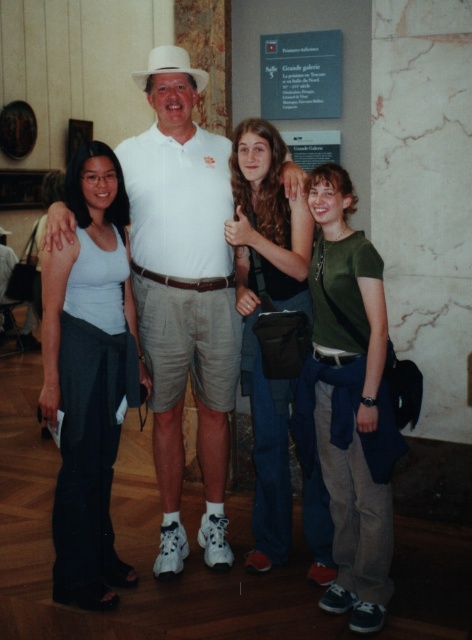
You are an artist trying to sketch the scene. You notice the green cotton shirt at center and the white matte cowboy hat at center. Which object should you draw first if you want to follow the rule of drawing taller objects before shorter ones?

The green cotton shirt at center is taller than the white matte cowboy hat at center, so you should draw the green cotton shirt at center first.

Based on the scene description, which object is taller between the white cotton shirt at center and the green matte shirt at right?

The white cotton shirt at center is much taller than the green matte shirt at right.

You are a photographer trying to capture the group photo. You notice the white matte tank top at left and the white cotton shirt at center. Which one is more visible in the photo due to their positions?

The white cotton shirt at center is more visible because the white matte tank top at left is behind it, blocking part of the tank top from view.